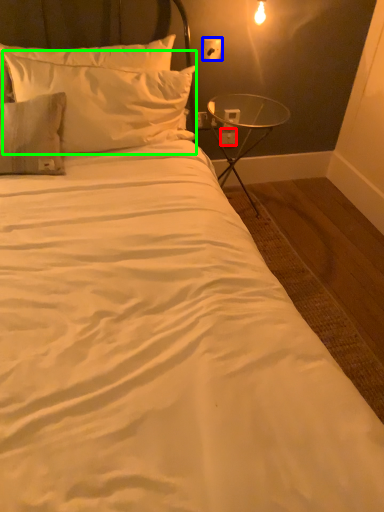
Question: Considering the real-world distances, which object is closest to electric outlet (highlighted by a red box)? electric outlet (highlighted by a blue box) or pillow (highlighted by a green box).

Choices:
 (A) electric outlet
 (B) pillow

Answer: (A)